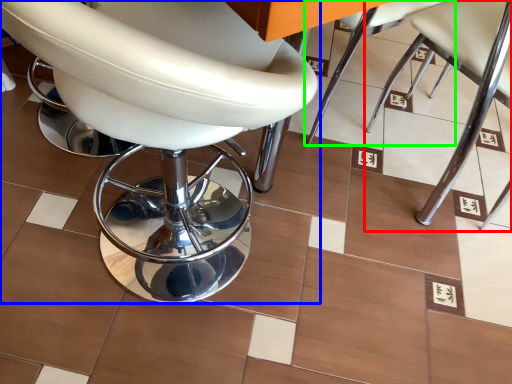
Question: Considering the real-world distances, which object is closest to chair (highlighted by a red box)? chair (highlighted by a blue box) or chair (highlighted by a green box).

Choices:
 (A) chair
 (B) chair

Answer: (B)